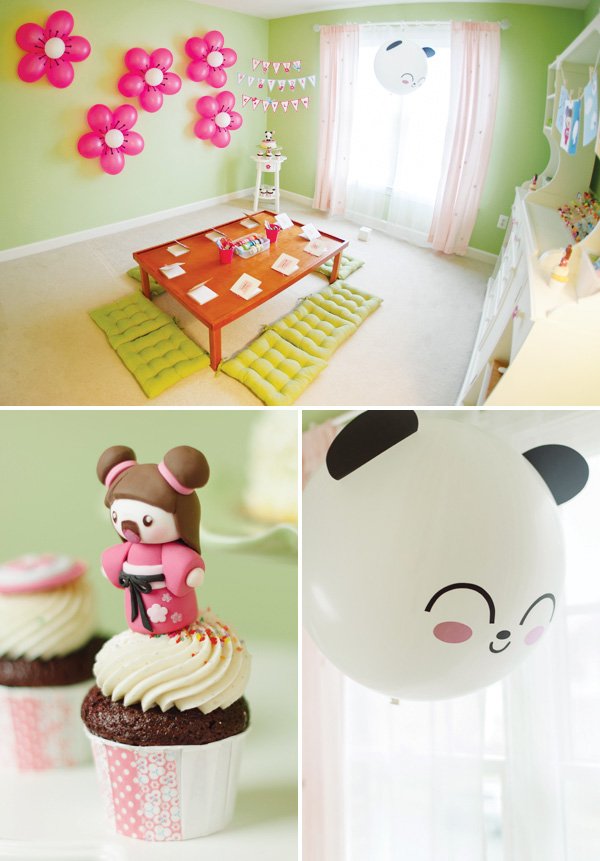
Where is `white wooden dresser`? Image resolution: width=600 pixels, height=861 pixels. white wooden dresser is located at coordinates (541, 225).